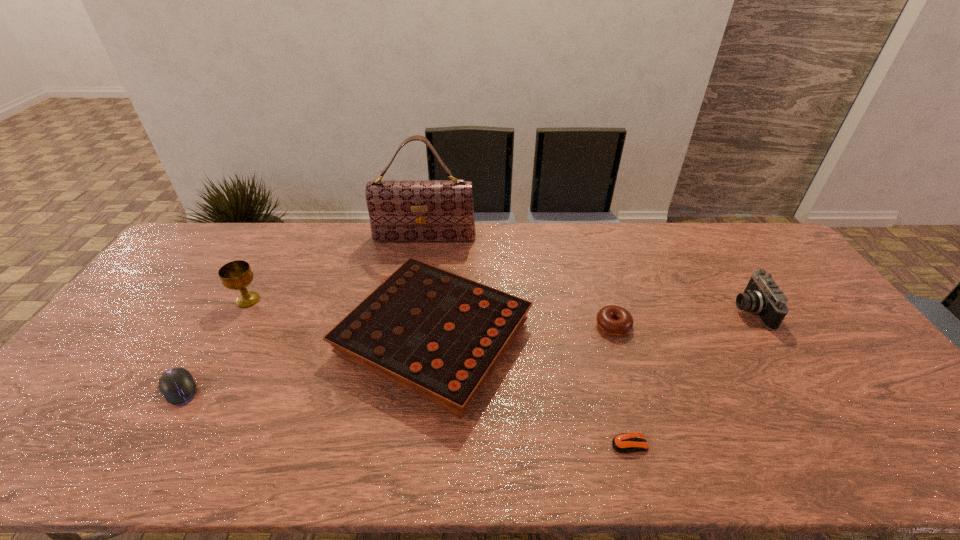
Image resolution: width=960 pixels, height=540 pixels. Identify the location of object positioned at the near edge. (623, 443).

The width and height of the screenshot is (960, 540). Find the location of `free space at the far edge of the desktop`. free space at the far edge of the desktop is located at coordinates (608, 239).

This screenshot has height=540, width=960. Find the location of `free spot at the near edge of the desktop`. free spot at the near edge of the desktop is located at coordinates (194, 437).

Locate an element on the screen. Image resolution: width=960 pixels, height=540 pixels. free space at the left edge of the desktop is located at coordinates (179, 313).

This screenshot has width=960, height=540. Identify the location of free space at the right edge of the desktop. (851, 339).

I want to click on free space at the far left corner of the desktop, so 207,238.

Where is `empty space between the gameboard and the camera`? Image resolution: width=960 pixels, height=540 pixels. empty space between the gameboard and the camera is located at coordinates (591, 325).

You are a GUI agent. You are given a task and a screenshot of the screen. Output one action in this format:
    pyautogui.click(x=<x>, y=<y>)
    Task: Click on the vacant space in between the shortest object and the fourth tallest object
    Image resolution: width=960 pixels, height=540 pixels.
    Given the screenshot: What is the action you would take?
    pyautogui.click(x=532, y=391)

Locate an element on the screen. This screenshot has width=960, height=540. empty space between the farthest object and the rightmost object is located at coordinates (587, 274).

Find the location of a particular element. This screenshot has height=540, width=960. free spot between the nearer computer mouse and the fourth shortest object is located at coordinates (532, 391).